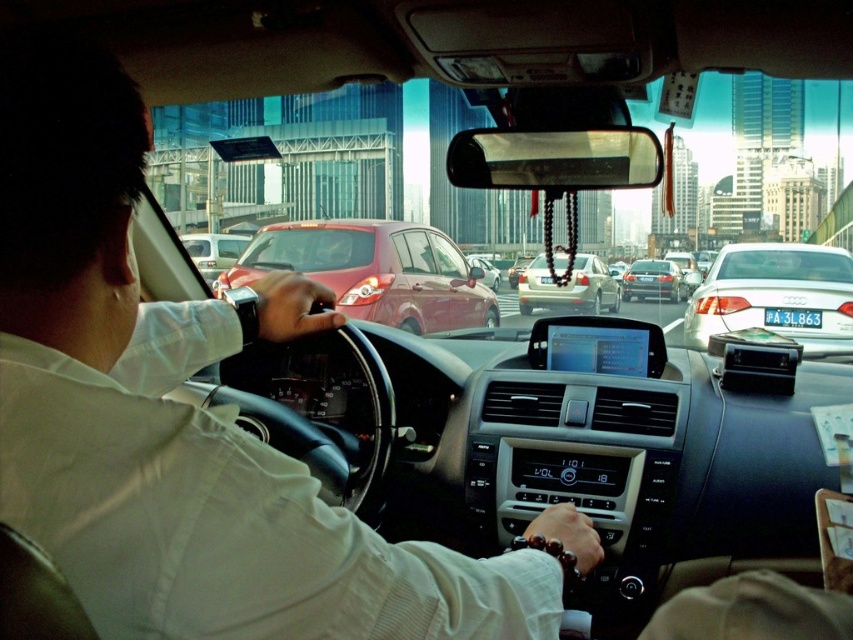
You are a passenger in a car and notice two vehicles ahead on the road. The glossy red car at center and the satin black sedan at center. Which one is more to the left?

The glossy red car at center is positioned on the left side of the satin black sedan at center, so it is more to the left.

You are a passenger in the car and want to know what is directly in front of you at the coordinates point (213, 252). What object is located there?

The matte white van at center is located at point (213, 252).